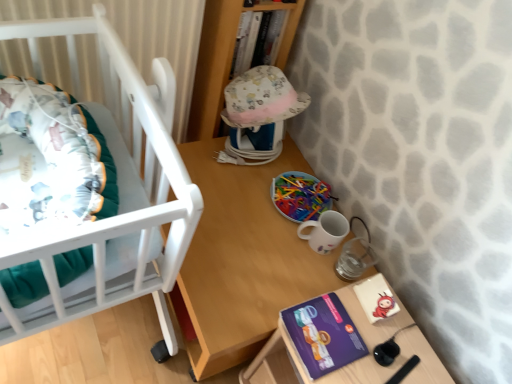
Where is `free spot in front of white glossy mug at lower right`? The height and width of the screenshot is (384, 512). free spot in front of white glossy mug at lower right is located at coordinates point(292,274).